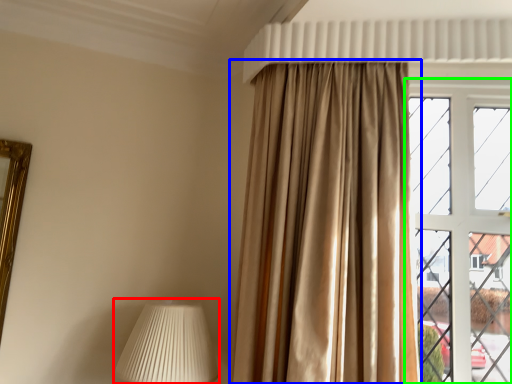
Question: Which object is positioned closest to table lamp (highlighted by a red box)? Select from curtain (highlighted by a blue box) and window (highlighted by a green box).

Choices:
 (A) curtain
 (B) window

Answer: (A)